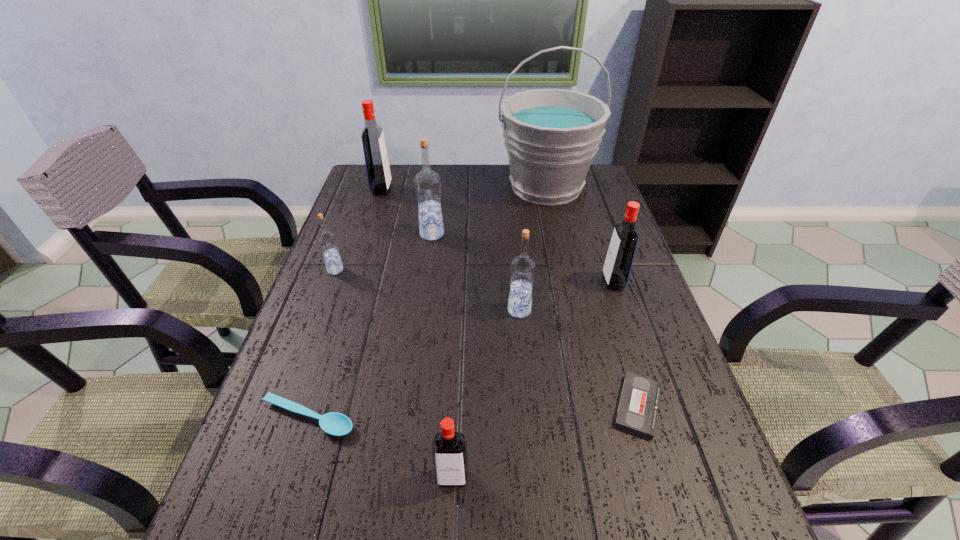
Where is `the second farthest blue vodka`? the second farthest blue vodka is located at coordinates (327, 241).

The width and height of the screenshot is (960, 540). I want to click on the leftmost vodka, so click(327, 241).

The height and width of the screenshot is (540, 960). Find the location of `the fifth object from right to left`. the fifth object from right to left is located at coordinates (449, 447).

At what (x,y) coordinates should I click in order to perform the action: click on the nearest object. Please return your answer as a coordinate pair (x, y). Looking at the image, I should click on (449, 447).

The height and width of the screenshot is (540, 960). What are the coordinates of `spoon` in the screenshot? It's located at (336, 424).

Identify the location of the shortest object. (637, 412).

You are a GUI agent. You are given a task and a screenshot of the screen. Output one action in this format:
    pyautogui.click(x=<x>, y=<y>)
    Task: Click on the vacant space located on the left of the blue bucket
    
    Given the screenshot: What is the action you would take?
    pyautogui.click(x=403, y=187)

In order to click on free spot located on the front and back of the second vodka from left to right in this screenshot , I will do `click(458, 189)`.

Locate an element on the screen. vacant space located 0.130m on the back of the seventh nearest object is located at coordinates (436, 204).

At what (x,y) coordinates should I click in order to perform the action: click on vacant space located 0.390m on the front and back of the rightmost vodka. Please return your answer as a coordinate pair (x, y). Looking at the image, I should click on (455, 282).